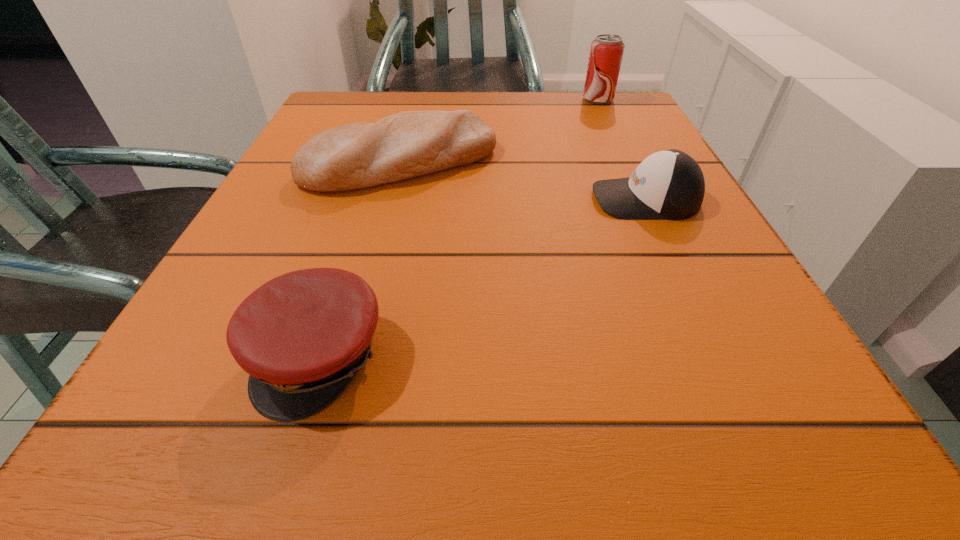
Locate an element on the screen. unoccupied position between the nearest object and the farthest object is located at coordinates (459, 228).

What are the coordinates of `empty space that is in between the bread and the farther cap` in the screenshot? It's located at (523, 180).

Find the location of a particular element. This screenshot has width=960, height=540. free space between the left cap and the right cap is located at coordinates (483, 278).

Where is `free space that is in between the bread and the tallest object`? The width and height of the screenshot is (960, 540). free space that is in between the bread and the tallest object is located at coordinates pos(499,131).

The height and width of the screenshot is (540, 960). Find the location of `blank region between the bread and the left cap`. blank region between the bread and the left cap is located at coordinates (360, 259).

Identify the location of vacant point located between the farther cap and the tallest object. (622, 149).

Image resolution: width=960 pixels, height=540 pixels. In order to click on free space between the bread and the nearest object in this screenshot , I will do `click(360, 259)`.

Image resolution: width=960 pixels, height=540 pixels. What are the coordinates of `free area in between the left cap and the bread` in the screenshot? It's located at (360, 259).

Locate an element on the screen. free spot between the right cap and the farthest object is located at coordinates (622, 149).

This screenshot has width=960, height=540. Find the location of `object that is the third closest to the tallest object`. object that is the third closest to the tallest object is located at coordinates (302, 337).